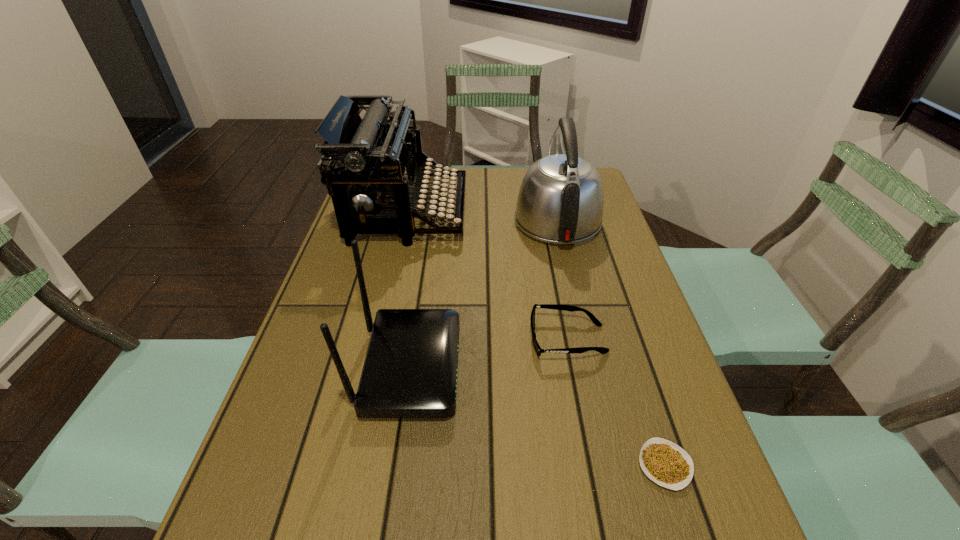
Locate an element on the screen. The height and width of the screenshot is (540, 960). sunglasses that is at the right edge is located at coordinates (602, 350).

This screenshot has height=540, width=960. I want to click on legume at the right edge, so click(x=664, y=462).

This screenshot has width=960, height=540. Find the location of `object that is at the far left corner`. object that is at the far left corner is located at coordinates (373, 159).

Find the location of `object that is at the far right corner`. object that is at the far right corner is located at coordinates (560, 201).

Find the location of `vacant space at the left edge of the desktop`. vacant space at the left edge of the desktop is located at coordinates (319, 506).

Find the location of `free spot at the right edge of the desktop`. free spot at the right edge of the desktop is located at coordinates (604, 376).

Where is `empty space that is in between the typewriter and the kettle`? The width and height of the screenshot is (960, 540). empty space that is in between the typewriter and the kettle is located at coordinates (482, 216).

The image size is (960, 540). Identify the location of empty location between the shortest object and the third shortest object. (538, 416).

Where is `vacant area that lies between the kettle and the router`? The width and height of the screenshot is (960, 540). vacant area that lies between the kettle and the router is located at coordinates (483, 294).

You are a GUI agent. You are given a task and a screenshot of the screen. Output one action in this format:
    pyautogui.click(x=<x>, y=<y>)
    Task: Click on the vacant area that lies between the sunglasses and the router
    The image size is (960, 540).
    Given the screenshot: What is the action you would take?
    pyautogui.click(x=489, y=353)